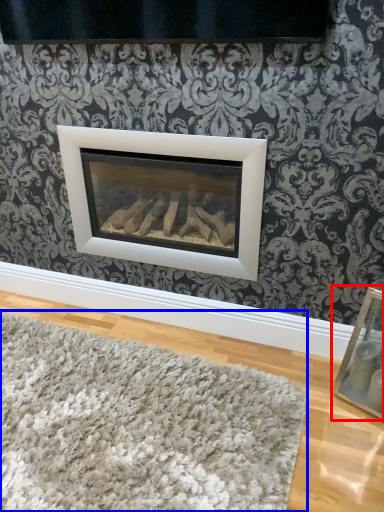
Question: Which point is closer to the camera, picture frame (highlighted by a red box) or mat (highlighted by a blue box)?

Choices:
 (A) picture frame
 (B) mat

Answer: (B)